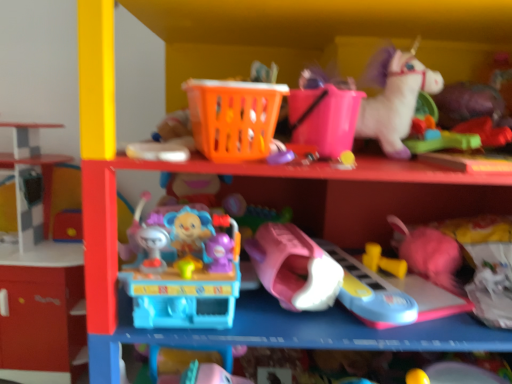
The width and height of the screenshot is (512, 384). I want to click on green rubber toy at upper right, placed as the 9th toy when sorted from left to right, so click(438, 138).

What do you see at coordinates (234, 118) in the screenshot? I see `orange plastic basket at upper center, which is the 2th toy from left to right` at bounding box center [234, 118].

You are a GUI agent. You are given a task and a screenshot of the screen. Output one action in this format:
    pyautogui.click(x=<x>, y=<y>)
    Task: Click on the orange plastic basket at upper center, which is the 2th toy from left to right
    The height and width of the screenshot is (384, 512).
    Given the screenshot: What is the action you would take?
    pyautogui.click(x=234, y=118)

The height and width of the screenshot is (384, 512). What do you see at coordinates (370, 293) in the screenshot?
I see `matte pink plastic toy at lower center, which is the sixth toy in left-to-right order` at bounding box center [370, 293].

In order to click on pink plastic toy car at center, the fourth toy in the left-to-right sequence in this screenshot , I will do `click(294, 267)`.

Find the location of `translucent plastic toy at center, which appears as the 10th toy when viewed from the right`. translucent plastic toy at center, which appears as the 10th toy when viewed from the right is located at coordinates (183, 270).

Considering the relative positions of pink plastic bucket at upper center, positioned as the sixth toy in right-to-left order, and matte pink plastic toy at lower center, which is the sixth toy in left-to-right order, in the image provided, is pink plastic bucket at upper center, positioned as the sixth toy in right-to-left order, to the right of matte pink plastic toy at lower center, which is the sixth toy in left-to-right order, from the viewer's perspective?

In fact, pink plastic bucket at upper center, positioned as the sixth toy in right-to-left order, is to the left of matte pink plastic toy at lower center, which is the sixth toy in left-to-right order.

Identify the location of the 1st toy behind the pink plastic bucket at upper center, positioned as the sixth toy in right-to-left order. This screenshot has height=384, width=512. (370, 293).

From the image's perspective, is pink plastic bucket at upper center, positioned as the sixth toy in right-to-left order, below matte pink plastic toy at lower center, the 5th toy from the right?

No, from the image's perspective, pink plastic bucket at upper center, positioned as the sixth toy in right-to-left order, is not below matte pink plastic toy at lower center, the 5th toy from the right.

Is pink plastic bucket at upper center, which is counted as the 5th toy, starting from the left, spatially inside matte pink plastic toy at lower center, which is the sixth toy in left-to-right order, or outside of it?

The correct answer is: outside.

From the picture: In terms of height, does green rubber toy at upper right, which ranks as the 2th toy in right-to-left order, look taller or shorter compared to rubberized green toy at upper right, acting as the first toy starting from the right?

In the image, green rubber toy at upper right, which ranks as the 2th toy in right-to-left order, appears to be taller than rubberized green toy at upper right, acting as the first toy starting from the right.

Which is correct: green rubber toy at upper right, which ranks as the 2th toy in right-to-left order, is inside rubberized green toy at upper right, acting as the first toy starting from the right, or outside of it?

green rubber toy at upper right, which ranks as the 2th toy in right-to-left order, lies outside rubberized green toy at upper right, acting as the first toy starting from the right.

Does point (429, 123) lie behind point (477, 132)?

Yes, point (429, 123) is behind point (477, 132).

From a real-world perspective, which is physically above, green rubber toy at upper right, which ranks as the 2th toy in right-to-left order, or rubberized green toy at upper right, which is the 10th toy in left-to-right order?

rubberized green toy at upper right, which is the 10th toy in left-to-right order, from a real-world perspective.

Are matte pink plastic toy at lower center, the 5th toy from the right, and white plush unicorn at upper right, acting as the seventh toy starting from the left, making contact?

No, matte pink plastic toy at lower center, the 5th toy from the right, is not beside white plush unicorn at upper right, acting as the seventh toy starting from the left.

Starting from the matte pink plastic toy at lower center, the 5th toy from the right, which toy is the 3rd one behind? Please provide its 2D coordinates.

[(394, 97)]

Which is more to the right, matte pink plastic toy at lower center, which is the sixth toy in left-to-right order, or white plush unicorn at upper right, marked as the 4th toy in a right-to-left arrangement?

From the viewer's perspective, white plush unicorn at upper right, marked as the 4th toy in a right-to-left arrangement, appears more on the right side.

Considering the relative sizes of matte pink plastic toy at lower center, which is the sixth toy in left-to-right order, and white plush unicorn at upper right, acting as the seventh toy starting from the left, in the image provided, is matte pink plastic toy at lower center, which is the sixth toy in left-to-right order, taller than white plush unicorn at upper right, acting as the seventh toy starting from the left,?

No, matte pink plastic toy at lower center, which is the sixth toy in left-to-right order, is not taller than white plush unicorn at upper right, acting as the seventh toy starting from the left.

Locate an element on the screen. Image resolution: width=512 pixels, height=384 pixels. the 6th toy above the pink plastic toy car at center, the fourth toy in the left-to-right sequence (from the image's perspective) is located at coordinates (324, 113).

From the image's perspective, relative to pink plastic toy car at center, placed as the 7th toy when sorted from right to left, is pink plastic bucket at upper center, which is counted as the 5th toy, starting from the left, above or below?

pink plastic bucket at upper center, which is counted as the 5th toy, starting from the left, is situated higher than pink plastic toy car at center, placed as the 7th toy when sorted from right to left, in the image.

Does pink plastic bucket at upper center, positioned as the sixth toy in right-to-left order, have a greater width compared to pink plastic toy car at center, the fourth toy in the left-to-right sequence?

Incorrect, the width of pink plastic bucket at upper center, positioned as the sixth toy in right-to-left order, does not surpass that of pink plastic toy car at center, the fourth toy in the left-to-right sequence.

Does pink plastic bucket at upper center, which is counted as the 5th toy, starting from the left, have a lesser height compared to pink plastic toy car at center, placed as the 7th toy when sorted from right to left?

No, pink plastic bucket at upper center, which is counted as the 5th toy, starting from the left, is not shorter than pink plastic toy car at center, placed as the 7th toy when sorted from right to left.

Does yellow rubber dumbbells at lower center, the 3th toy positioned from the right, touch rubberized green toy at upper right, acting as the first toy starting from the right?

No, yellow rubber dumbbells at lower center, the 3th toy positioned from the right, is not beside rubberized green toy at upper right, acting as the first toy starting from the right.

From a real-world perspective, relative to rubberized green toy at upper right, which is the 10th toy in left-to-right order, is yellow rubber dumbbells at lower center, acting as the eighth toy starting from the left, vertically above or below?

Clearly, from a real-world perspective, yellow rubber dumbbells at lower center, acting as the eighth toy starting from the left, is below rubberized green toy at upper right, which is the 10th toy in left-to-right order.

Which is more to the right, yellow rubber dumbbells at lower center, acting as the eighth toy starting from the left, or rubberized green toy at upper right, acting as the first toy starting from the right?

rubberized green toy at upper right, acting as the first toy starting from the right, is more to the right.

Consider the image. Is yellow rubber dumbbells at lower center, the 3th toy positioned from the right, shorter than rubberized green toy at upper right, which is the 10th toy in left-to-right order?

No, yellow rubber dumbbells at lower center, the 3th toy positioned from the right, is not shorter than rubberized green toy at upper right, which is the 10th toy in left-to-right order.

Which of these two, translucent purple toy at center, marked as the 3th toy in a left-to-right arrangement, or white plush unicorn at upper right, acting as the seventh toy starting from the left, is bigger?

white plush unicorn at upper right, acting as the seventh toy starting from the left.

Image resolution: width=512 pixels, height=384 pixels. I want to click on the 5th toy positioned below the white plush unicorn at upper right, marked as the 4th toy in a right-to-left arrangement (from the image's perspective), so click(279, 153).

From a real-world perspective, which is physically below, translucent purple toy at center, placed as the 8th toy when sorted from right to left, or white plush unicorn at upper right, marked as the 4th toy in a right-to-left arrangement?

translucent purple toy at center, placed as the 8th toy when sorted from right to left.

Considering the sizes of objects yellow rubber dumbbells at lower center, acting as the eighth toy starting from the left, and orange plastic basket at upper center, which is the 2th toy from left to right, in the image provided, who is taller, yellow rubber dumbbells at lower center, acting as the eighth toy starting from the left, or orange plastic basket at upper center, which is the 2th toy from left to right,?

With more height is orange plastic basket at upper center, which is the 2th toy from left to right.

From a real-world perspective, is yellow rubber dumbbells at lower center, the 3th toy positioned from the right, physically located above or below orange plastic basket at upper center, which is counted as the 9th toy, starting from the right?

In terms of real-world spatial position, yellow rubber dumbbells at lower center, the 3th toy positioned from the right, is below orange plastic basket at upper center, which is counted as the 9th toy, starting from the right.

Does yellow rubber dumbbells at lower center, acting as the eighth toy starting from the left, appear on the right side of orange plastic basket at upper center, which is counted as the 9th toy, starting from the right?

Indeed, yellow rubber dumbbells at lower center, acting as the eighth toy starting from the left, is positioned on the right side of orange plastic basket at upper center, which is counted as the 9th toy, starting from the right.

Is yellow rubber dumbbells at lower center, acting as the eighth toy starting from the left, not within orange plastic basket at upper center, which is the 2th toy from left to right?

Indeed, yellow rubber dumbbells at lower center, acting as the eighth toy starting from the left, is completely outside orange plastic basket at upper center, which is the 2th toy from left to right.

Where is `the 1st toy to the right when counting from the pink plastic bucket at upper center, which is counted as the 5th toy, starting from the left`? This screenshot has width=512, height=384. the 1st toy to the right when counting from the pink plastic bucket at upper center, which is counted as the 5th toy, starting from the left is located at coordinates (370, 293).

Where is `the 1st toy directly above the green rubber toy at upper right, which ranks as the 2th toy in right-to-left order (from a real-world perspective)`? the 1st toy directly above the green rubber toy at upper right, which ranks as the 2th toy in right-to-left order (from a real-world perspective) is located at coordinates (485, 131).

From the image, which object appears to be farther from green rubber toy at upper right, which ranks as the 2th toy in right-to-left order, yellow rubber dumbbells at lower center, acting as the eighth toy starting from the left, or smooth plastic shelf at left?

The object further to green rubber toy at upper right, which ranks as the 2th toy in right-to-left order, is smooth plastic shelf at left.

Which object lies nearer to the anchor point pink plastic toy car at center, the fourth toy in the left-to-right sequence, rubberized green toy at upper right, which is the 10th toy in left-to-right order, or pink plastic bucket at upper center, which is counted as the 5th toy, starting from the left?

Based on the image, pink plastic bucket at upper center, which is counted as the 5th toy, starting from the left, appears to be nearer to pink plastic toy car at center, the fourth toy in the left-to-right sequence.

Consider the image. Considering their positions, is matte pink plastic toy at lower center, the 5th toy from the right, positioned closer to white plush unicorn at upper right, acting as the seventh toy starting from the left, than orange plastic basket at upper center, which is counted as the 9th toy, starting from the right?

orange plastic basket at upper center, which is counted as the 9th toy, starting from the right, is positioned closer to the anchor white plush unicorn at upper right, acting as the seventh toy starting from the left.

Considering their positions, is translucent purple toy at center, marked as the 3th toy in a left-to-right arrangement, positioned further to translucent plastic toy at center, which appears as the 10th toy when viewed from the right, than pink plastic bucket at upper center, which is counted as the 5th toy, starting from the left?

Based on the image, pink plastic bucket at upper center, which is counted as the 5th toy, starting from the left, appears to be further to translucent plastic toy at center, which appears as the 10th toy when viewed from the right.

Looking at this image, from the image, which object appears to be nearer to rubberized green toy at upper right, which is the 10th toy in left-to-right order, translucent purple toy at center, placed as the 8th toy when sorted from right to left, or yellow rubber dumbbells at lower center, the 3th toy positioned from the right?

Among the two, yellow rubber dumbbells at lower center, the 3th toy positioned from the right, is located nearer to rubberized green toy at upper right, which is the 10th toy in left-to-right order.

Considering their positions, is smooth plastic shelf at left positioned further to orange plastic basket at upper center, which is the 2th toy from left to right, than translucent plastic toy at center, the 1th toy when ordered from left to right?

smooth plastic shelf at left lies further to orange plastic basket at upper center, which is the 2th toy from left to right, than the other object.

Considering their positions, is translucent purple toy at center, placed as the 8th toy when sorted from right to left, positioned further to green rubber toy at upper right, which ranks as the 2th toy in right-to-left order, than rubberized green toy at upper right, acting as the first toy starting from the right?

translucent purple toy at center, placed as the 8th toy when sorted from right to left, lies further to green rubber toy at upper right, which ranks as the 2th toy in right-to-left order, than the other object.

Considering their positions, is orange plastic basket at upper center, which is counted as the 9th toy, starting from the right, positioned closer to green rubber toy at upper right, placed as the 9th toy when sorted from left to right, than white plush unicorn at upper right, acting as the seventh toy starting from the left?

white plush unicorn at upper right, acting as the seventh toy starting from the left, lies closer to green rubber toy at upper right, placed as the 9th toy when sorted from left to right, than the other object.

Identify the location of toy located between smooth plastic shelf at left and orange plastic basket at upper center, which is counted as the 9th toy, starting from the right, in the left-right direction. (183, 270).